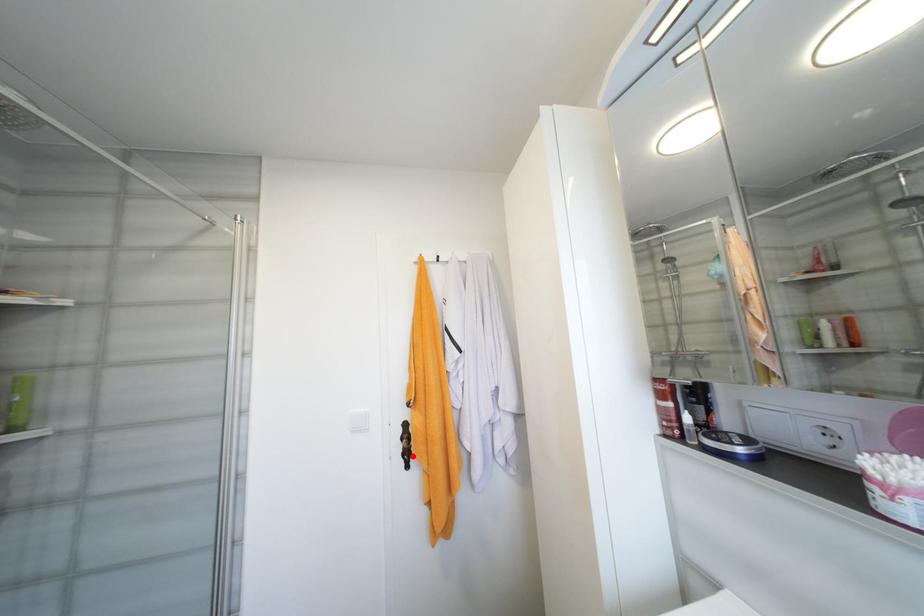
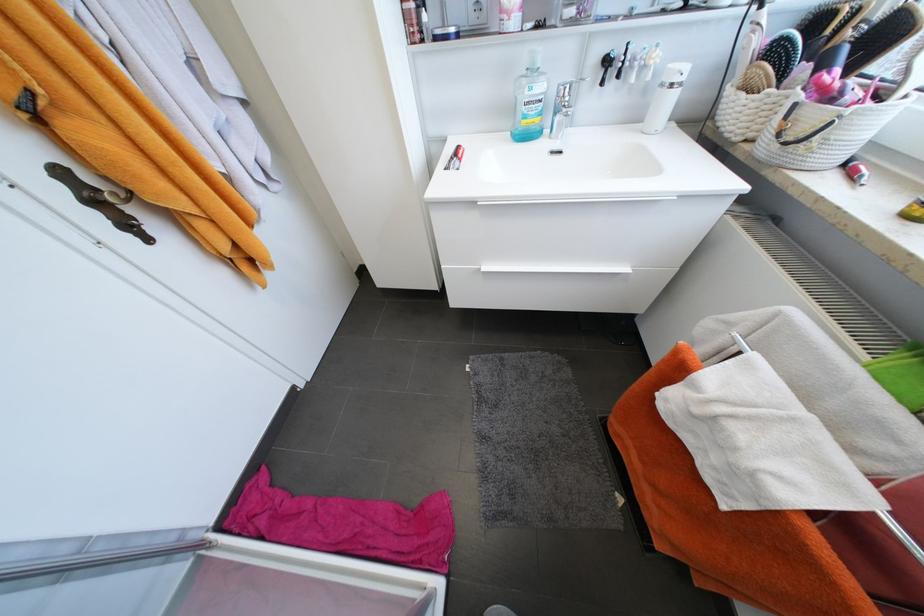
Locate, in the second image, the point that corresponds to the highlighted location in the first image.

(132, 225)